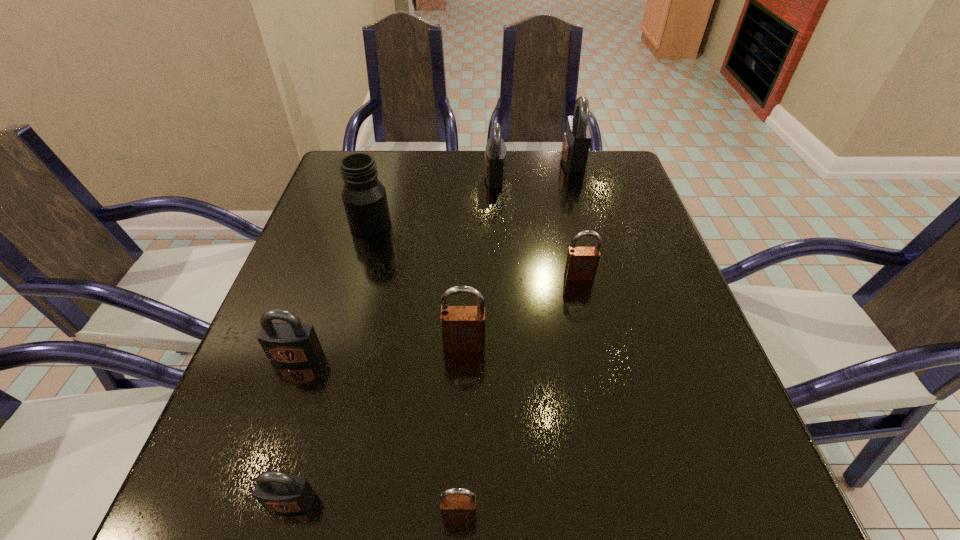
In order to click on free space that satisfies the following two spatial constraints: 1. on the front of the fifth padlock from left to right near the keyhole; 2. on the front-facing side of the smallest brown padlock in this screenshot , I will do `click(510, 515)`.

Locate an element on the screen. vacant region that satisfies the following two spatial constraints: 1. on the front of the tallest padlock near the keyhole; 2. on the front-facing side of the second smallest brown padlock is located at coordinates pos(607,276).

Identify the location of free spot that satisfies the following two spatial constraints: 1. on the front of the rightmost gray padlock near the keyhole; 2. on the front of the nearest gray padlock near the keyhole. Image resolution: width=960 pixels, height=540 pixels. (671, 501).

This screenshot has height=540, width=960. What are the coordinates of `free location that satisfies the following two spatial constraints: 1. on the front of the second gray padlock from right to left near the keyhole; 2. on the front-facing side of the biggest brown padlock` in the screenshot? It's located at (502, 345).